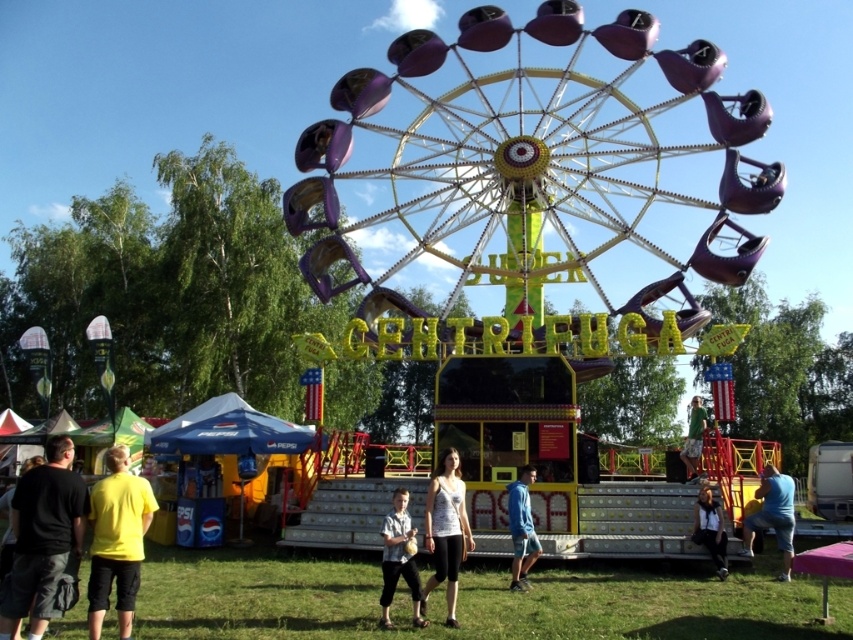
You are a photographer at the fairground and want to capture both the light blue shirt at center and the green fabric shirt at center in a single photo. Which shirt should you focus on first to ensure both are in the frame?

The light blue shirt at center is located below the green fabric shirt at center. To capture both in a single photo, focus on the green fabric shirt at center first, as it is higher up, ensuring the lower light blue shirt at center will also be included in the frame.

You are standing at the entrance of the amusement park and see the SUPER CENTRIFUGA ride with its central hub. A person wearing a light blue shirt is standing at the point marked by coordinates point [398,557]. If you want to take a photo of the person and the ride together in the frame, where should you position yourself relative to the SUPER CENTRIFUGA ride?

To capture both the person wearing the light blue shirt at center and the SUPER CENTRIFUGA ride in the same frame, you should position yourself in front of the ride, facing towards the central hub where the person is located. This ensures both the ride and the person are visible together in the photo.

You are standing at the entrance of the amusement park and see the metallic purple ferris wheel at center. If you walk straight ahead, will you approach the ferris wheel?

The metallic purple ferris wheel at center is located at point (534, 172), which means it is positioned centrally in the image. Walking straight ahead from the entrance would lead you towards the center of the scene, so yes, walking straight ahead will bring you closer to the metallic purple ferris wheel at center.